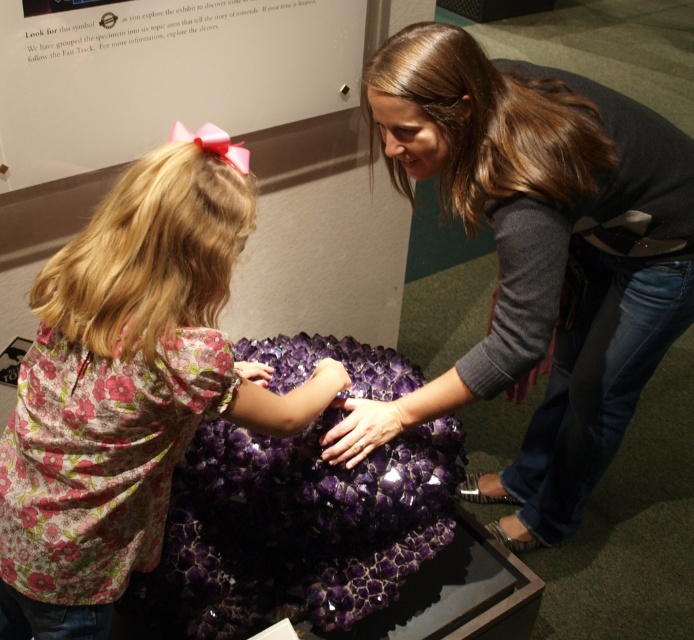
Based on the photo, is matte purple rock at center below floral fabric shirt at lower left?

No, matte purple rock at center is not below floral fabric shirt at lower left.

Consider the image. Who is positioned more to the right, matte purple rock at center or floral fabric shirt at lower left?

matte purple rock at center

Find the location of a particular element. This screenshot has width=694, height=640. matte purple rock at center is located at coordinates (539, 257).

The height and width of the screenshot is (640, 694). What are the coordinates of `matte purple rock at center` in the screenshot? It's located at (539, 257).